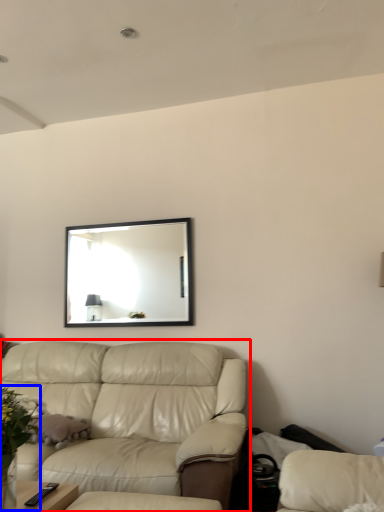
Question: Among these objects, which one is nearest to the camera, studio couch (highlighted by a red box) or floral arrangement (highlighted by a blue box)?

Choices:
 (A) studio couch
 (B) floral arrangement

Answer: (B)